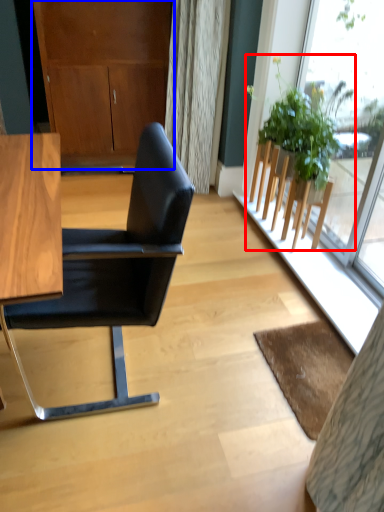
Question: Which of the following is the closest to the observer, houseplant (highlighted by a red box) or dresser (highlighted by a blue box)?

Choices:
 (A) houseplant
 (B) dresser

Answer: (A)